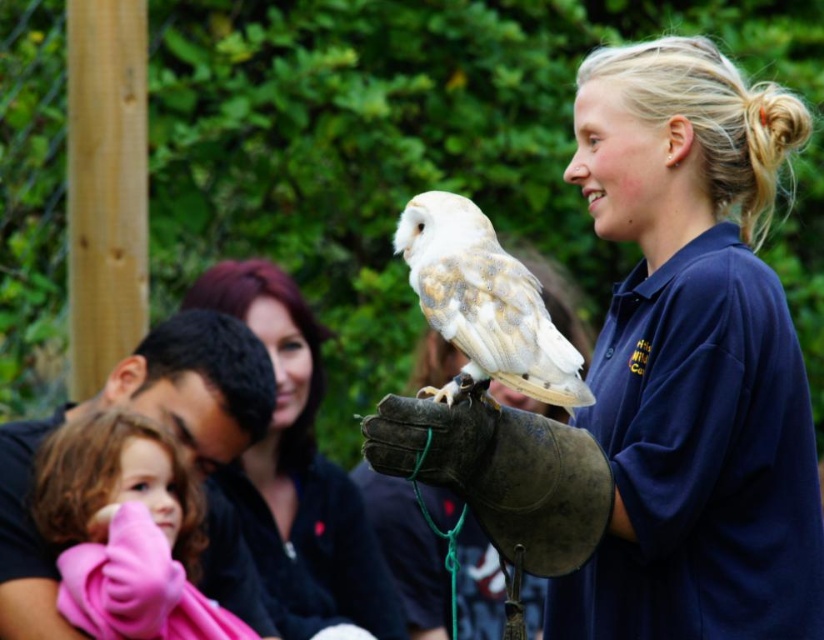
You are attending an event and see two people in the background. One is wearing a blue smooth shirt at center and the other is wearing a smooth black shirt at center. Which shirt is closer to you?

The blue smooth shirt at center is closer to you because it is in front of the smooth black shirt at center.

You are attending an educational event and notice two items in the scene. One is the black cotton shirt at left and the other is the white fluffy owl at center. Which of these two items is taller?

The black cotton shirt at left is taller than the white fluffy owl at center.